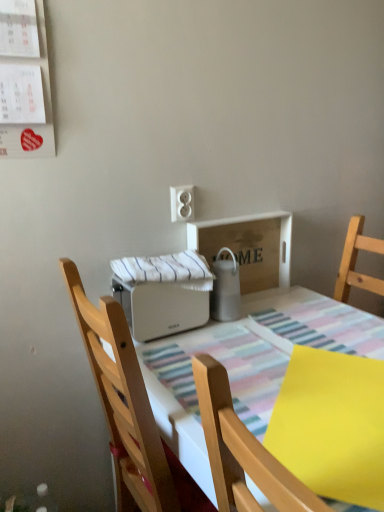
Locate an element on the screen. This screenshot has width=384, height=512. free space in front of wooden tray at center is located at coordinates (267, 326).